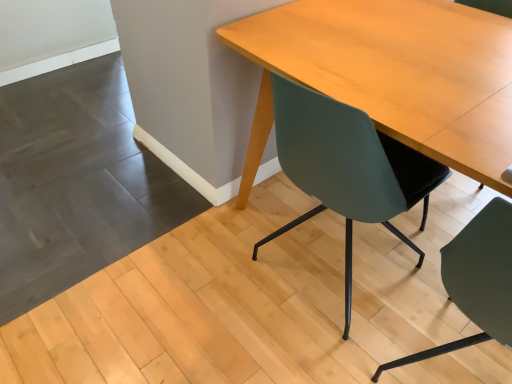
Question: Is teal matte chair at center, acting as the second chair starting from the left, facing away from light wood table at center?

Choices:
 (A) no
 (B) yes

Answer: (B)

Question: Can you confirm if teal matte chair at center, the 1th chair in the right-to-left sequence, is thinner than light wood table at center?

Choices:
 (A) yes
 (B) no

Answer: (A)

Question: From a real-world perspective, is teal matte chair at center, acting as the second chair starting from the left, on light wood table at center?

Choices:
 (A) yes
 (B) no

Answer: (A)

Question: Can you confirm if teal matte chair at center, the 1th chair in the right-to-left sequence, is smaller than light wood table at center?

Choices:
 (A) yes
 (B) no

Answer: (A)

Question: Considering the relative positions of teal matte chair at center, acting as the second chair starting from the left, and light wood table at center in the image provided, is teal matte chair at center, acting as the second chair starting from the left, to the left of light wood table at center from the viewer's perspective?

Choices:
 (A) yes
 (B) no

Answer: (B)

Question: From their relative heights in the image, would you say light wood table at center is taller or shorter than teal matte chair at center, the first chair from the left?

Choices:
 (A) tall
 (B) short

Answer: (B)

Question: From the image's perspective, is light wood table at center positioned above or below teal matte chair at center, positioned as the 2th chair in right-to-left order?

Choices:
 (A) below
 (B) above

Answer: (B)

Question: In the image, is light wood table at center positioned in front of or behind teal matte chair at center, the first chair from the left?

Choices:
 (A) behind
 (B) front

Answer: (B)

Question: In terms of size, does light wood table at center appear bigger or smaller than teal matte chair at center, positioned as the 2th chair in right-to-left order?

Choices:
 (A) small
 (B) big

Answer: (B)

Question: Visually, is teal matte chair at center, positioned as the 2th chair in right-to-left order, positioned to the left or to the right of light wood table at center?

Choices:
 (A) left
 (B) right

Answer: (A)

Question: Relative to light wood table at center, is teal matte chair at center, the first chair from the left, in front or behind?

Choices:
 (A) front
 (B) behind

Answer: (B)

Question: Is teal matte chair at center, the first chair from the left, bigger or smaller than light wood table at center?

Choices:
 (A) big
 (B) small

Answer: (B)

Question: Is point (287, 142) positioned closer to the camera than point (449, 147)?

Choices:
 (A) closer
 (B) farther

Answer: (B)

Question: From their relative heights in the image, would you say teal matte chair at center, the first chair from the left, is taller or shorter than teal matte chair at center, the 1th chair in the right-to-left sequence?

Choices:
 (A) short
 (B) tall

Answer: (A)

Question: From the image's perspective, relative to teal matte chair at center, acting as the second chair starting from the left, is teal matte chair at center, positioned as the 2th chair in right-to-left order, above or below?

Choices:
 (A) above
 (B) below

Answer: (A)